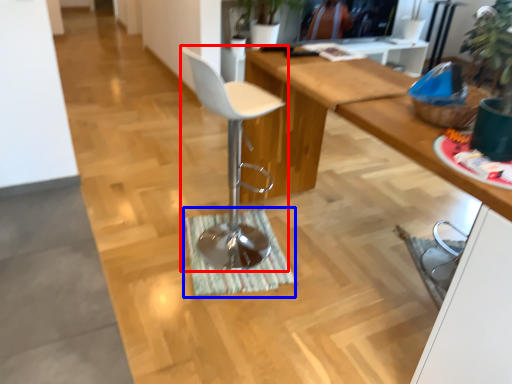
Question: Which of the following is the closest to the observer, chair (highlighted by a red box) or doormat (highlighted by a blue box)?

Choices:
 (A) chair
 (B) doormat

Answer: (A)